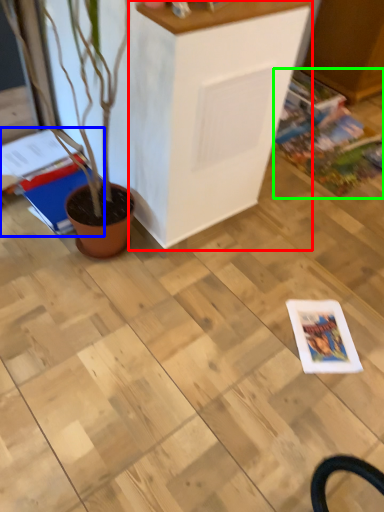
Question: Which is nearer to the furniture (highlighted by a red box)? magazine (highlighted by a blue box) or comic book (highlighted by a green box).

Choices:
 (A) magazine
 (B) comic book

Answer: (A)